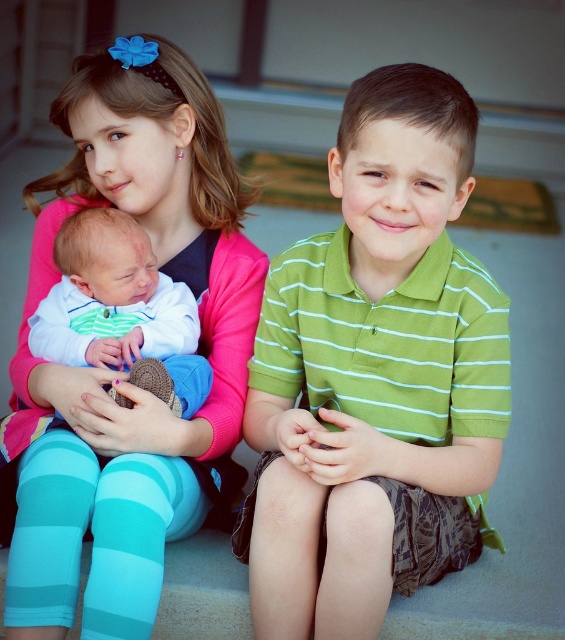
Question: Which point appears closest to the camera in this image?

Choices:
 (A) (226, 282)
 (B) (380, 605)

Answer: (B)

Question: Does green striped polo shirt at center come behind striped cotton onesie at lower left?

Choices:
 (A) no
 (B) yes

Answer: (A)

Question: Estimate the real-world distances between objects in this image. Which object is closer to the pink fabric at upper left?

Choices:
 (A) striped cotton onesie at lower left
 (B) green striped polo shirt at center

Answer: (A)

Question: Which point is closer to the camera?

Choices:
 (A) (71, 362)
 (B) (488, 371)
 (C) (10, 420)

Answer: (B)

Question: Can you confirm if green striped polo shirt at center is smaller than pink fabric at upper left?

Choices:
 (A) yes
 (B) no

Answer: (A)

Question: Does green striped polo shirt at center have a greater width compared to pink fabric at upper left?

Choices:
 (A) no
 (B) yes

Answer: (A)